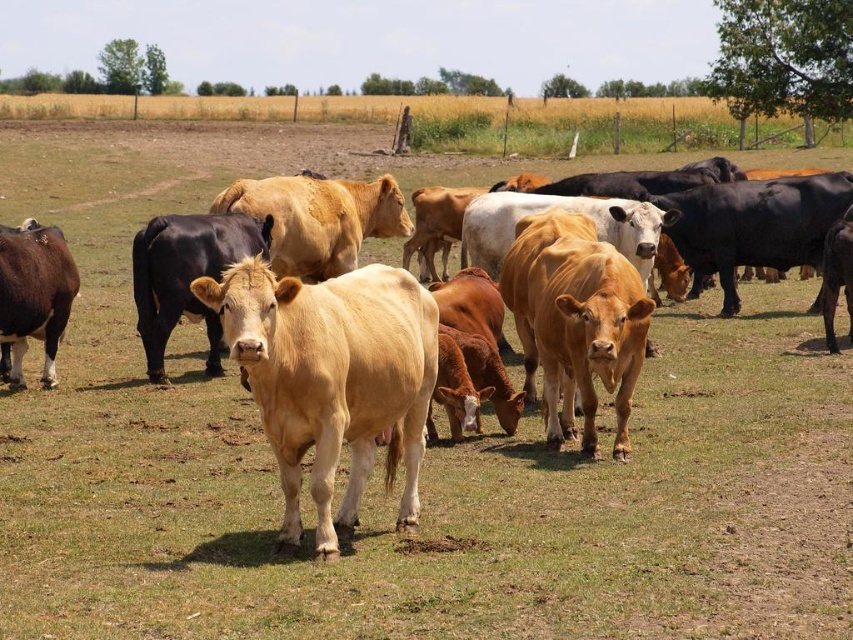
Is shiny black bull at center bigger than brown glossy cow at left?

Yes.

Is point (216, 362) closer to camera compared to point (71, 288)?

No, (216, 362) is further to viewer.

The image size is (853, 640). What are the coordinates of `shiny black bull at center` in the screenshot? It's located at (186, 275).

At what (x,y) coordinates should I click in order to perform the action: click on shiny black bull at center. Please return your answer as a coordinate pair (x, y). The image size is (853, 640). Looking at the image, I should click on (186, 275).